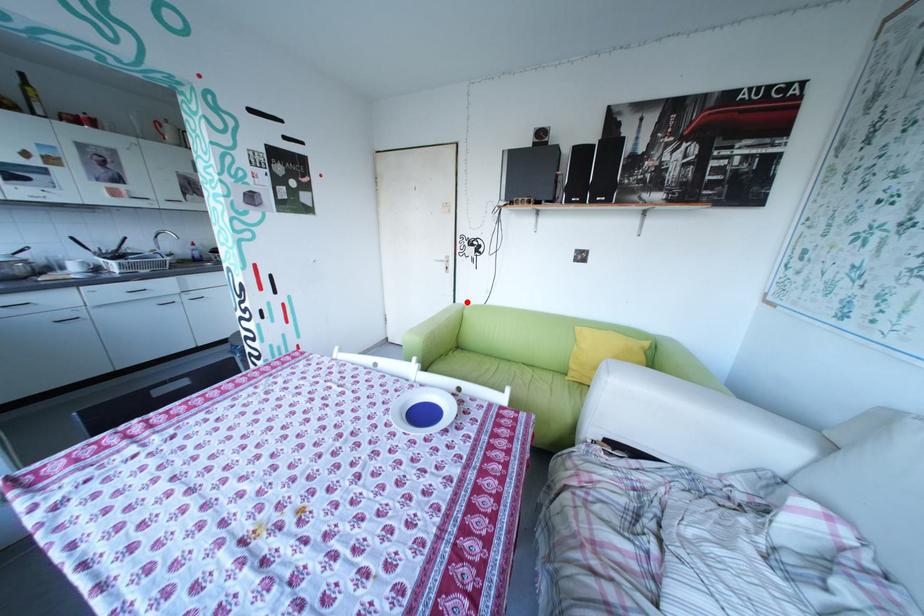
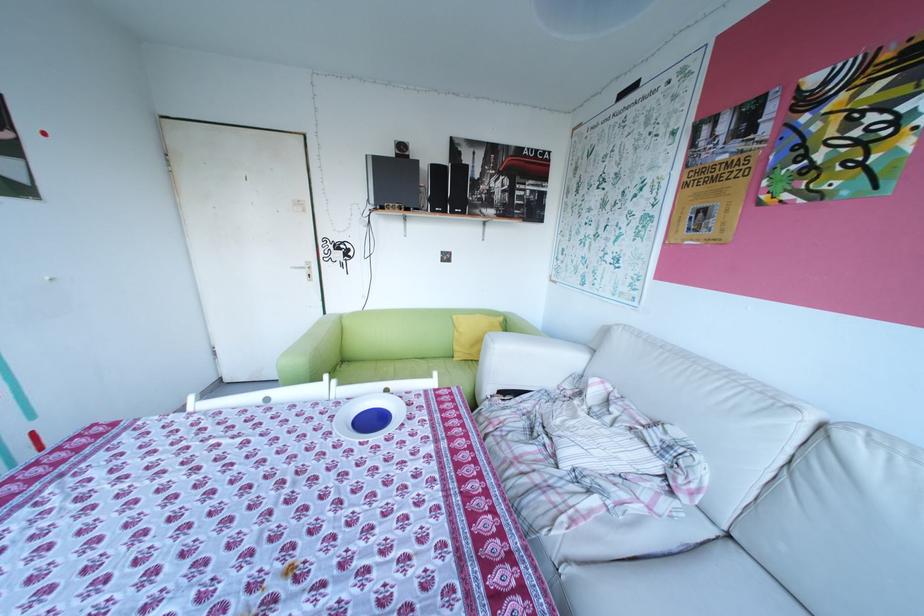
Where in the second image is the point corresponding to the highlighted location from the first image?

(337, 313)